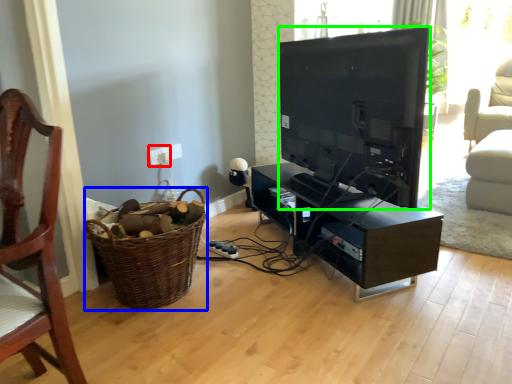
Question: Based on their relative distances, which object is farther from electric outlet (highlighted by a red box)? Choose from basket (highlighted by a blue box) and television (highlighted by a green box).

Choices:
 (A) basket
 (B) television

Answer: (B)